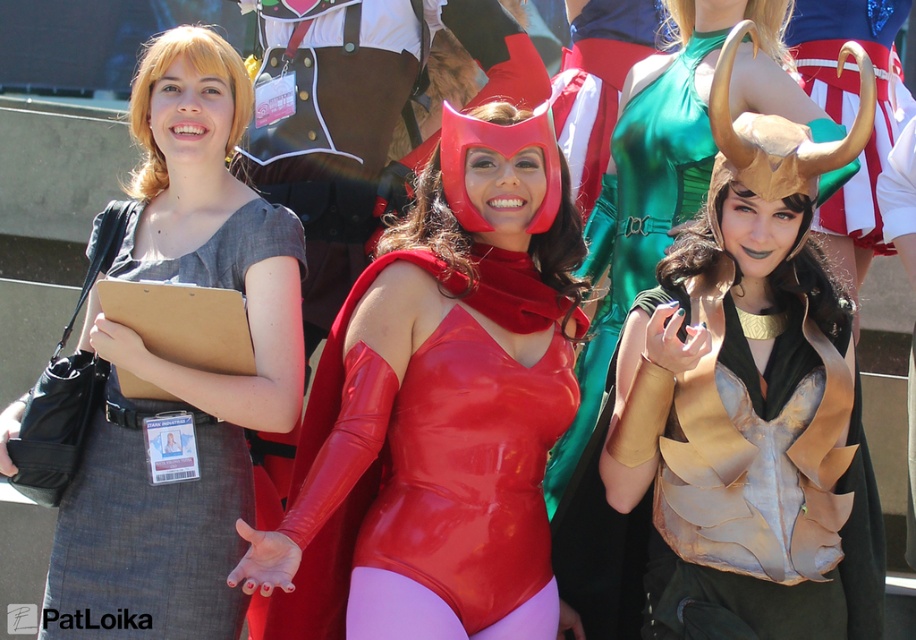
Question: Among these objects, which one is nearest to the camera?

Choices:
 (A) rubberized red bodysuit at center
 (B) gold metallic armor at center
 (C) matte gray dress at center

Answer: (A)

Question: Can you confirm if gold metallic armor at center is bigger than rubberized red bodysuit at center?

Choices:
 (A) no
 (B) yes

Answer: (A)

Question: Estimate the real-world distances between objects in this image. Which object is farther from the matte gray dress at center?

Choices:
 (A) gold metallic armor at center
 (B) rubberized red bodysuit at center

Answer: (A)

Question: Which object is closer to the camera taking this photo?

Choices:
 (A) rubberized red bodysuit at center
 (B) matte gray dress at center
 (C) gold metallic armor at center

Answer: (A)

Question: Is gold metallic armor at center positioned behind matte gray dress at center?

Choices:
 (A) no
 (B) yes

Answer: (A)

Question: Considering the relative positions of gold metallic armor at center and matte gray dress at center in the image provided, where is gold metallic armor at center located with respect to matte gray dress at center?

Choices:
 (A) left
 (B) right

Answer: (B)